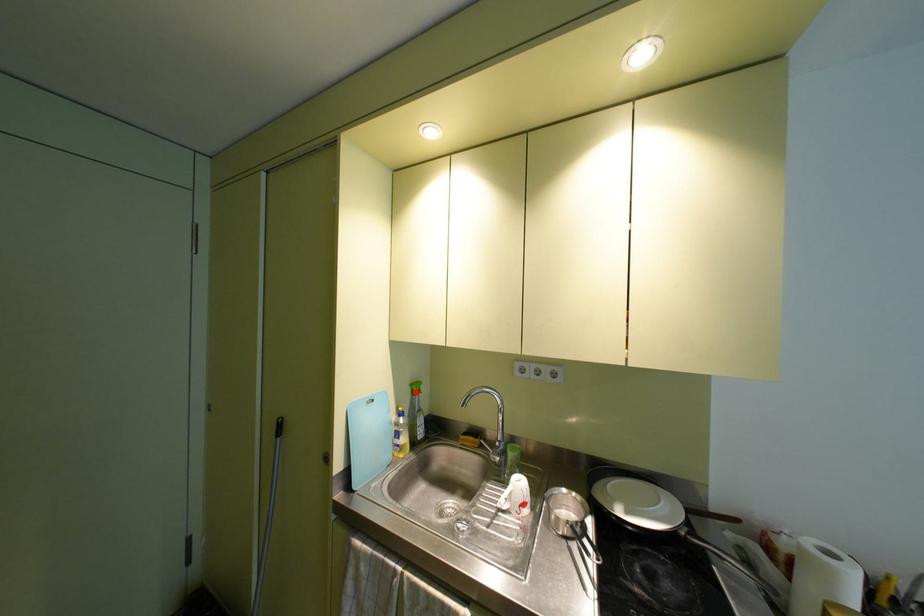
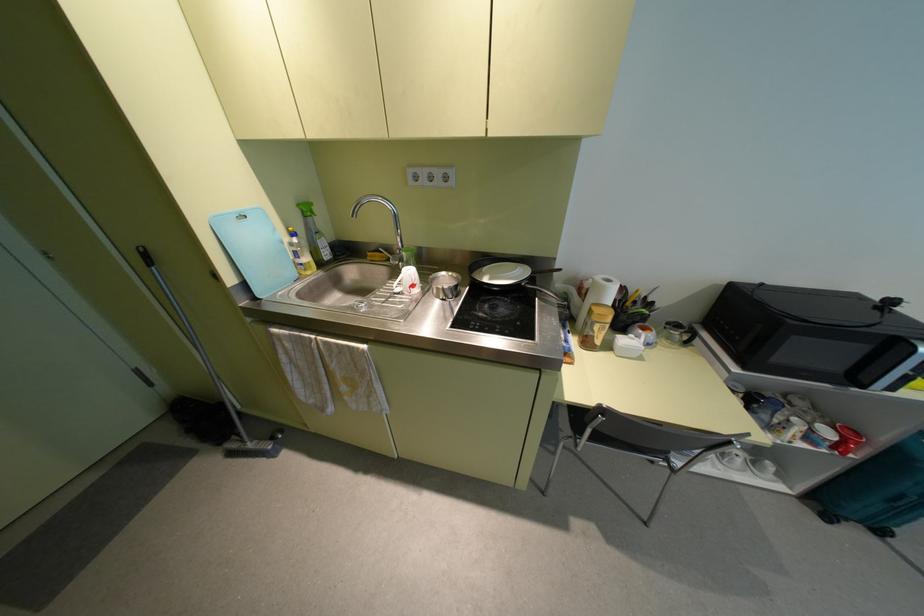
Where in the second image is the point corresponding to the highlighted location from the first image?

(308, 214)